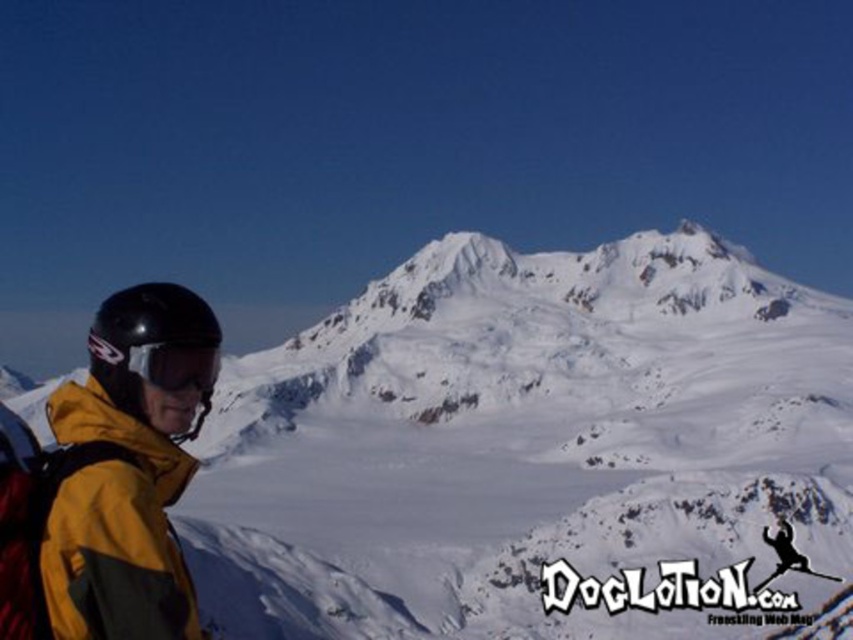
Question: Which object appears farthest from the camera in this image?

Choices:
 (A) shiny black ski at lower right
 (B) yellow matte jacket at lower left
 (C) matte black goggles at left
 (D) white powdery snow at center

Answer: (A)

Question: Can you confirm if white powdery snow at center is wider than yellow matte jacket at lower left?

Choices:
 (A) no
 (B) yes

Answer: (B)

Question: Does white powdery snow at center appear under yellow matte jacket at lower left?

Choices:
 (A) no
 (B) yes

Answer: (B)

Question: Among these objects, which one is farthest from the camera?

Choices:
 (A) yellow matte jacket at lower left
 (B) shiny black ski at lower right
 (C) matte black goggles at left
 (D) white powdery snow at center

Answer: (B)

Question: Is white powdery snow at center positioned before yellow matte jacket at lower left?

Choices:
 (A) no
 (B) yes

Answer: (A)

Question: Which of these objects is positioned farthest from the white powdery snow at center?

Choices:
 (A) shiny black ski at lower right
 (B) yellow matte jacket at lower left
 (C) matte black goggles at left

Answer: (C)